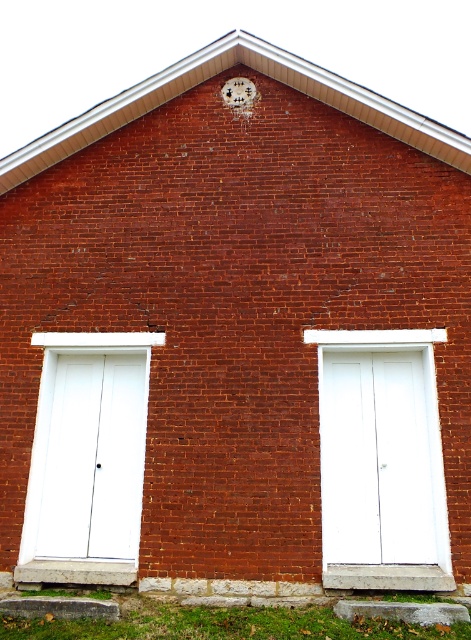
You are a delivery person trying to enter the building. You see the white wood door at center and the white matte door at left. Which door should you use if you need to carry a large package that requires more space?

You should use the white wood door at center because it has a larger size compared to the white matte door at left, providing more space for carrying a large package.